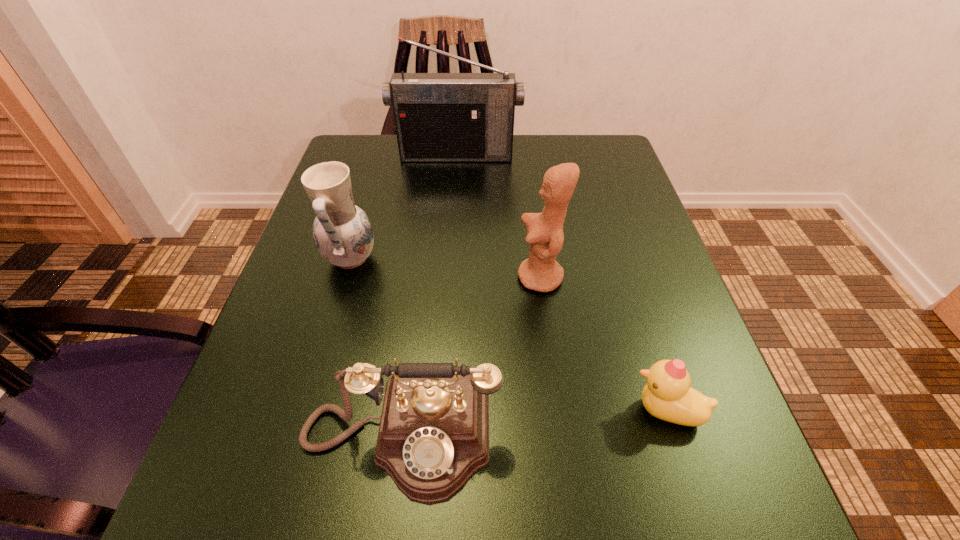
At what (x,y) coordinates should I click in order to perform the action: click on object present at the far left corner. Please return your answer as a coordinate pair (x, y). This screenshot has width=960, height=540. Looking at the image, I should click on (439, 117).

Find the location of a particular element. The height and width of the screenshot is (540, 960). object that is at the near left corner is located at coordinates (433, 436).

Where is `vacant space at the far edge of the desktop`? vacant space at the far edge of the desktop is located at coordinates (516, 175).

Locate an element on the screen. This screenshot has width=960, height=540. vacant space at the near edge is located at coordinates (543, 500).

This screenshot has height=540, width=960. In the image, there is a desktop. Find the location of `vacant area at the left edge`. vacant area at the left edge is located at coordinates (300, 261).

This screenshot has width=960, height=540. Identify the location of free location at the right edge of the desktop. (609, 256).

Where is `free spot at the near right corner of the desktop`? free spot at the near right corner of the desktop is located at coordinates (743, 510).

Locate an element on the screen. The height and width of the screenshot is (540, 960). free spot between the duckling and the fourth shortest object is located at coordinates (603, 344).

This screenshot has height=540, width=960. Identify the location of vacant space in between the farthest object and the telephone. (429, 296).

You are a GUI agent. You are given a task and a screenshot of the screen. Output one action in this format:
    pyautogui.click(x=<x>, y=<y>)
    Task: Click on the free point between the telephone and the shortest object
    Image resolution: width=960 pixels, height=540 pixels.
    Given the screenshot: What is the action you would take?
    pyautogui.click(x=534, y=424)